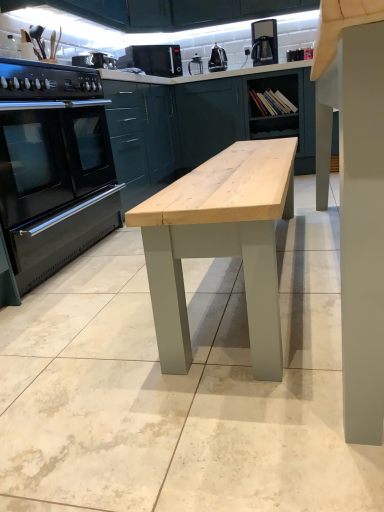
Question: Can you confirm if black plastic coffee machine at upper center is smaller than metallic silver kettle at upper center, the 2th appliance positioned from the left?

Choices:
 (A) no
 (B) yes

Answer: (A)

Question: Would you say black plastic coffee machine at upper center is a long distance from metallic silver kettle at upper center, the first appliance viewed from the right?

Choices:
 (A) no
 (B) yes

Answer: (A)

Question: From a real-world perspective, is black plastic coffee machine at upper center below metallic silver kettle at upper center, the first appliance from the back?

Choices:
 (A) no
 (B) yes

Answer: (A)

Question: Considering the relative sizes of black plastic coffee machine at upper center and metallic silver kettle at upper center, the first appliance viewed from the right, in the image provided, is black plastic coffee machine at upper center thinner than metallic silver kettle at upper center, the first appliance viewed from the right,?

Choices:
 (A) no
 (B) yes

Answer: (A)

Question: From the image's perspective, is black plastic coffee machine at upper center above metallic silver kettle at upper center, which appears as the 2th appliance when viewed from the front?

Choices:
 (A) yes
 (B) no

Answer: (A)

Question: Does black plastic coffee machine at upper center appear on the left side of metallic silver kettle at upper center, the 2th appliance positioned from the left?

Choices:
 (A) no
 (B) yes

Answer: (A)

Question: From a real-world perspective, is metallic silver toaster at upper center, the second appliance viewed from the right, beneath matte green cabinet at upper center?

Choices:
 (A) yes
 (B) no

Answer: (B)

Question: From a real-world perspective, is metallic silver toaster at upper center, which is counted as the first appliance, starting from the bottom, on matte green cabinet at upper center?

Choices:
 (A) no
 (B) yes

Answer: (B)

Question: Does metallic silver toaster at upper center, the second appliance viewed from the back, have a larger size compared to matte green cabinet at upper center?

Choices:
 (A) no
 (B) yes

Answer: (A)

Question: From the image's perspective, is metallic silver toaster at upper center, the second appliance viewed from the right, over matte green cabinet at upper center?

Choices:
 (A) yes
 (B) no

Answer: (A)

Question: Is metallic silver toaster at upper center, which appears as the second appliance when viewed from the top, shorter than matte green cabinet at upper center?

Choices:
 (A) yes
 (B) no

Answer: (A)

Question: Does metallic silver toaster at upper center, which appears as the second appliance when viewed from the top, have a lesser width compared to matte green cabinet at upper center?

Choices:
 (A) yes
 (B) no

Answer: (A)

Question: Can you confirm if black stainless steel oven at left is positioned to the left of black matte microwave at upper center?

Choices:
 (A) yes
 (B) no

Answer: (A)